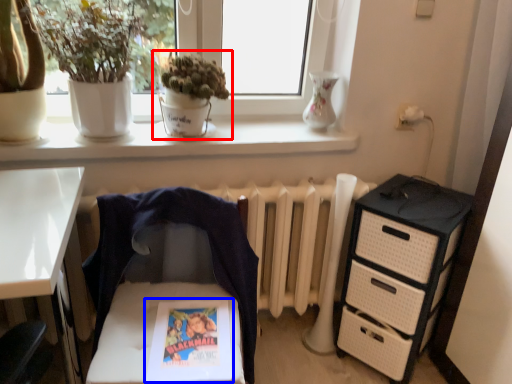
Question: Among these objects, which one is nearest to the camera, houseplant (highlighted by a red box) or comic book (highlighted by a blue box)?

Choices:
 (A) houseplant
 (B) comic book

Answer: (B)